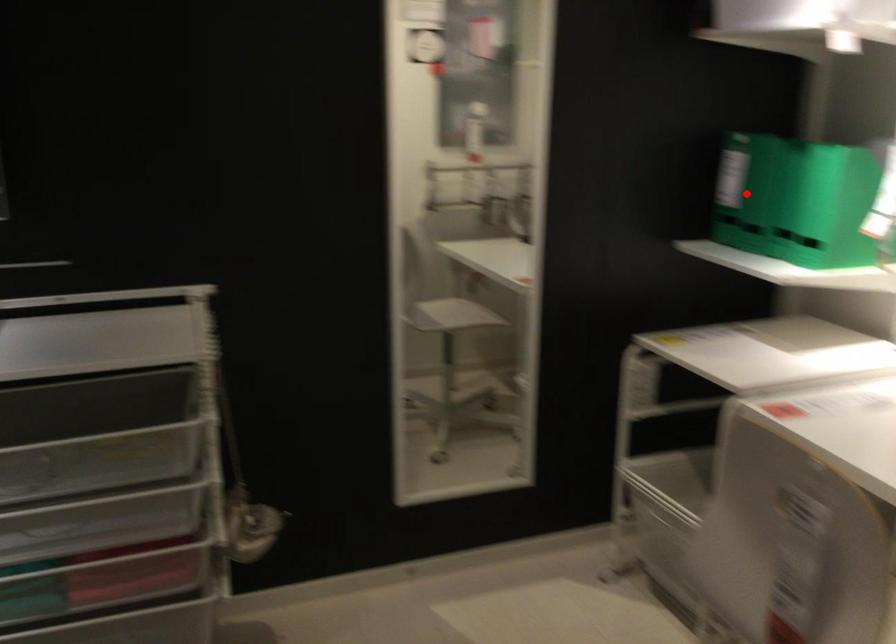
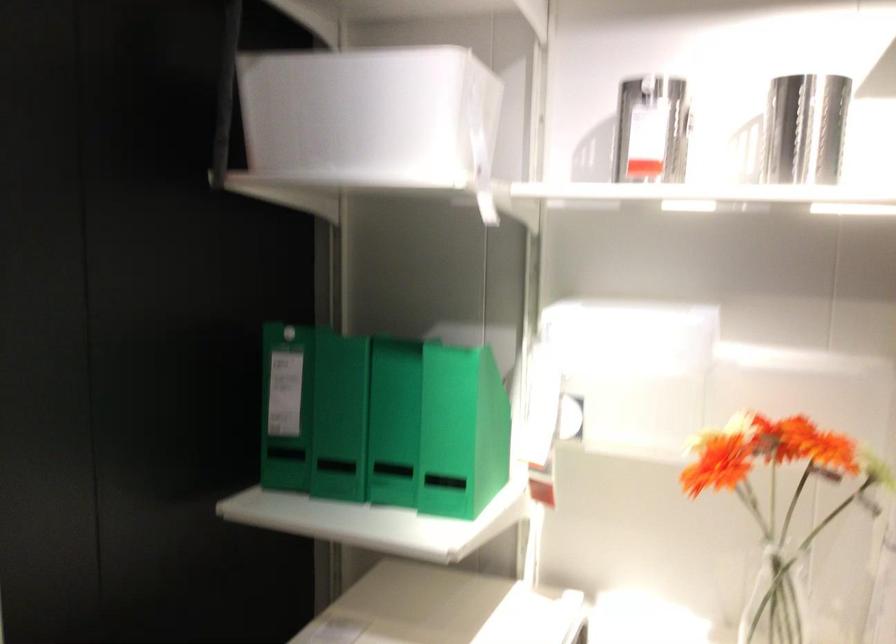
Locate, in the second image, the point that corresponds to the highlighted location in the first image.

(339, 417)